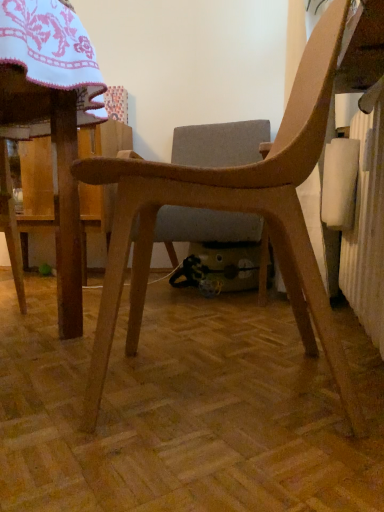
At what (x,y) coordinates should I click in order to perform the action: click on wooden chair at center. Please return your answer as a coordinate pair (x, y). This screenshot has width=384, height=512. Looking at the image, I should click on (231, 211).

Image resolution: width=384 pixels, height=512 pixels. Describe the element at coordinates (231, 211) in the screenshot. I see `wooden chair at center` at that location.

This screenshot has width=384, height=512. What are the coordinates of `wooden chair at center` in the screenshot? It's located at (231, 211).